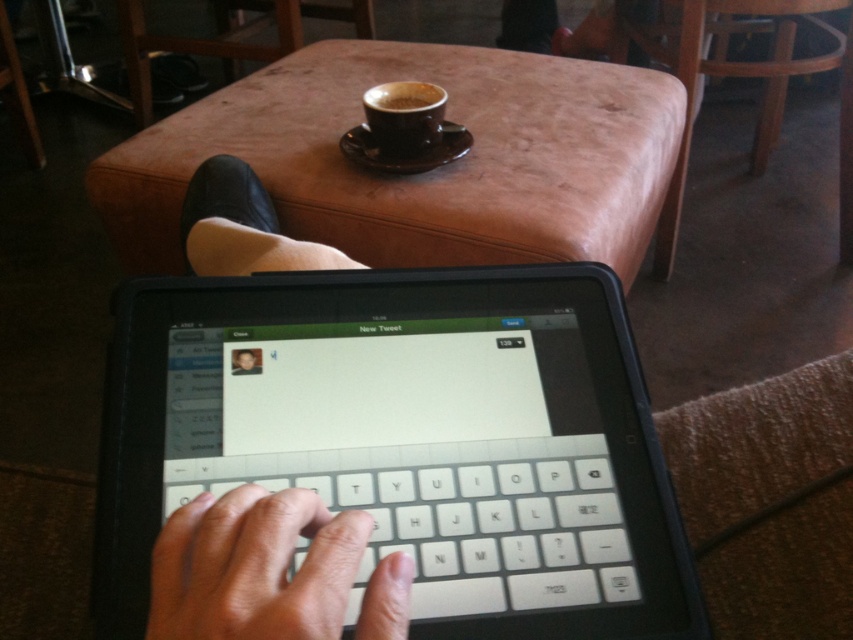
Does shiny brown cup at center have a greater width compared to smooth skin face at center?

Indeed, shiny brown cup at center has a greater width compared to smooth skin face at center.

Who is shorter, shiny brown cup at center or smooth skin face at center?

smooth skin face at center is shorter.

Which is in front, point (410, 124) or point (242, 353)?

Point (242, 353) is in front.

I want to click on shiny brown cup at center, so 404,115.

In the scene shown: Which is below, black ceramic cup at upper center or smooth skin face at center?

smooth skin face at center

Between black ceramic cup at upper center and smooth skin face at center, which one appears on the right side from the viewer's perspective?

Positioned to the right is black ceramic cup at upper center.

This screenshot has width=853, height=640. Find the location of `black ceramic cup at upper center`. black ceramic cup at upper center is located at coordinates (404, 97).

Does black plastic tablet at center appear on the right side of white plastic keyboard at center?

Incorrect, black plastic tablet at center is not on the right side of white plastic keyboard at center.

Is point (596, 563) more distant than point (517, 460)?

No.

The image size is (853, 640). In order to click on black plastic tablet at center in this screenshot , I will do `click(407, 440)`.